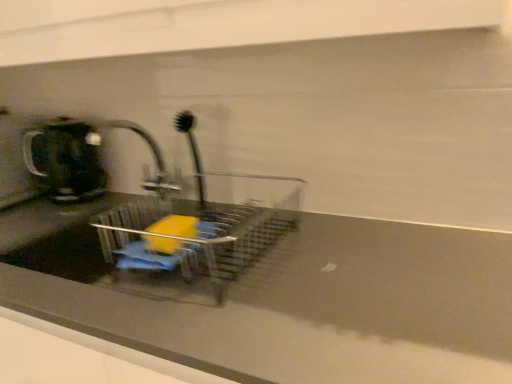
Identify the location of free space in front of matte black coffeepot at left. The width and height of the screenshot is (512, 384). (35, 218).